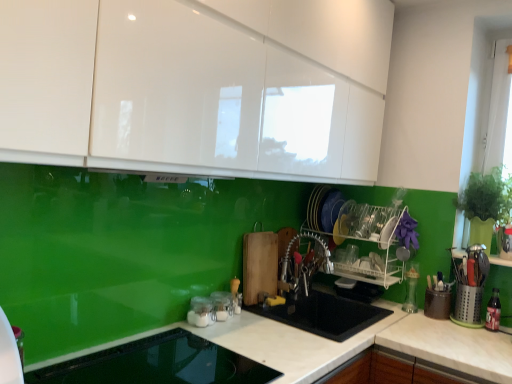
Question: Is point (372, 210) closer or farther from the camera than point (219, 301)?

Choices:
 (A) farther
 (B) closer

Answer: (A)

Question: From a real-world perspective, relative to clear glass jars at center, the 4th appliance from the back, is white plastic dish rack at center, the third appliance when ordered from right to left, vertically above or below?

Choices:
 (A) above
 (B) below

Answer: (A)

Question: Considering the real-world distances, which object is farthest from the white glossy cabinets at upper center?

Choices:
 (A) metallic silver utensils at center
 (B) metallic silver utensil holder at right, the 4th appliance viewed from the front
 (C) green glossy plant at right
 (D) clear glass jars at center, the fourth appliance from the right
 (E) white plastic dish rack at center, placed as the sixth appliance when sorted from front to back

Answer: (B)

Question: Estimate the real-world distances between objects in this image. Which object is farther from the metallic silver utensil holder at right, the second appliance positioned from the right?

Choices:
 (A) clear plastic bottle at right, which is the first appliance from right to left
 (B) smooth glass cooktop at lower center, the first appliance when ordered from left to right
 (C) white glossy countertop at center
 (D) white plastic dish rack at center, which is the 4th appliance from left to right
 (E) metallic silver utensils at center

Answer: (B)